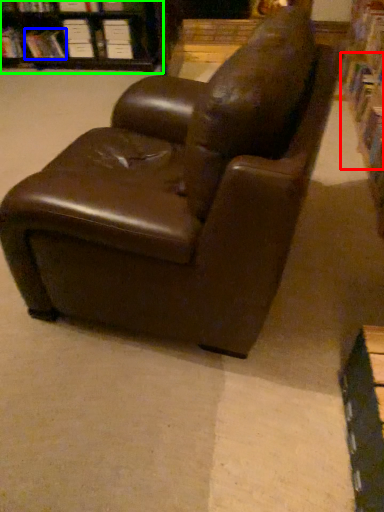
Question: Which object is positioned farthest from book (highlighted by a red box)? Select from book (highlighted by a blue box) and bookcase (highlighted by a green box).

Choices:
 (A) book
 (B) bookcase

Answer: (A)